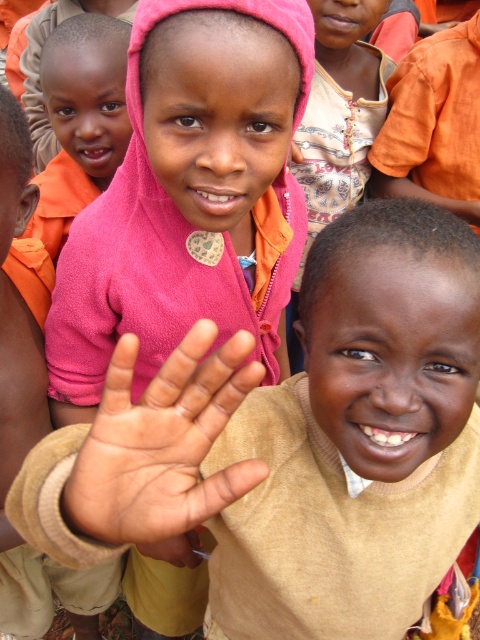
Who is positioned more to the right, pink fleece at center or pink fabric hand at center?

pink fabric hand at center

Is pink fleece at center bigger than pink fabric hand at center?

Indeed, pink fleece at center has a larger size compared to pink fabric hand at center.

The height and width of the screenshot is (640, 480). Find the location of `pink fleece at center`. pink fleece at center is located at coordinates (190, 196).

Is beige sweater at center bigger than pink fleece at upper center?

Yes, beige sweater at center is bigger than pink fleece at upper center.

Describe the element at coordinates (299, 442) in the screenshot. This screenshot has width=480, height=640. I see `beige sweater at center` at that location.

You are a GUI agent. You are given a task and a screenshot of the screen. Output one action in this format:
    pyautogui.click(x=<x>, y=<y>)
    Task: Click on the beige sweater at center
    This screenshot has width=480, height=640.
    Given the screenshot: What is the action you would take?
    pyautogui.click(x=299, y=442)

Between pink fabric hand at center and pink fleece at upper center, which one has more height?

Standing taller between the two is pink fleece at upper center.

From the picture: Does pink fabric hand at center have a larger size compared to pink fleece at upper center?

No.

Identify the location of pink fabric hand at center. The height and width of the screenshot is (640, 480). (162, 444).